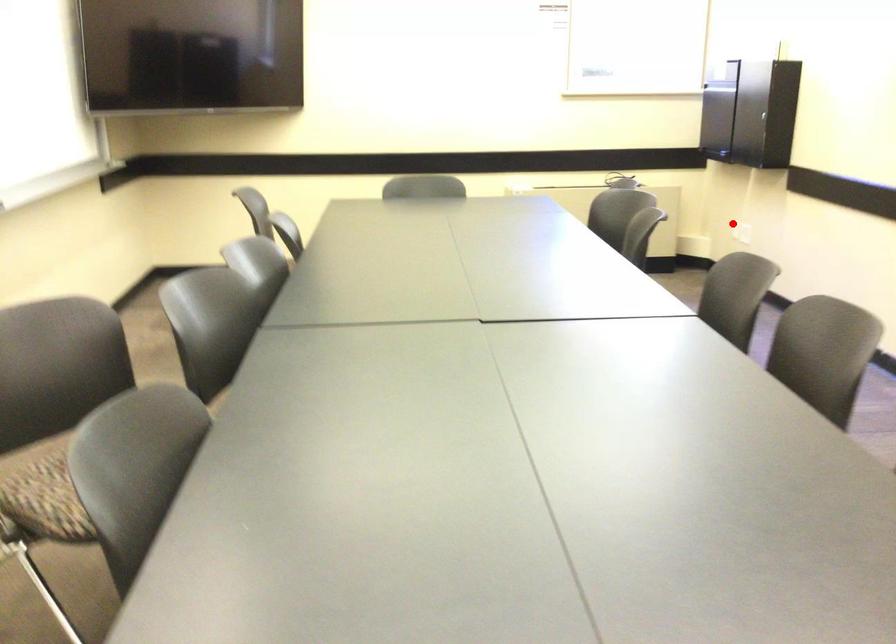
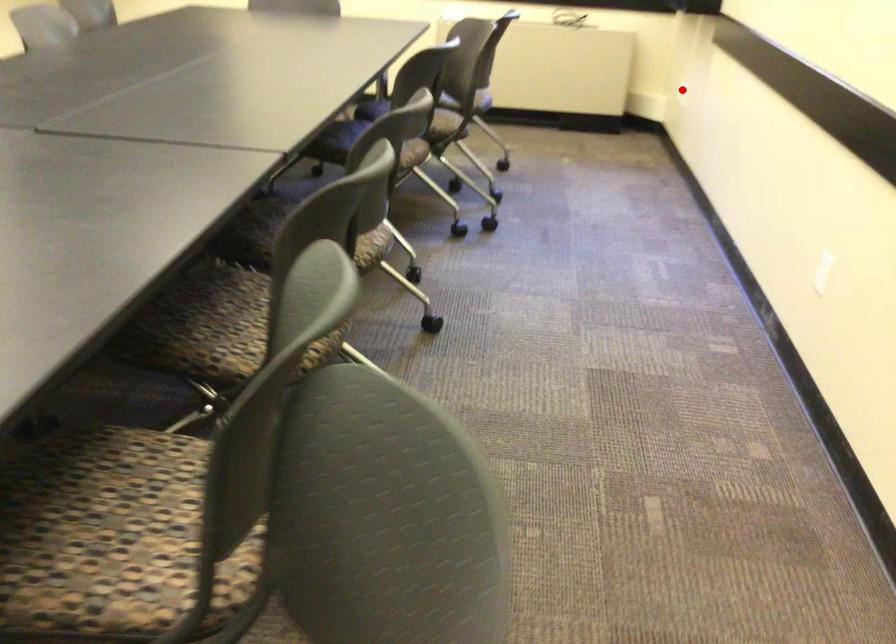
I am providing you with two images of the same scene from different viewpoints. A red point is marked on the first image and another point is marked on the second image. Does the point marked in image1 correspond to the same location as the one in image2?

Yes